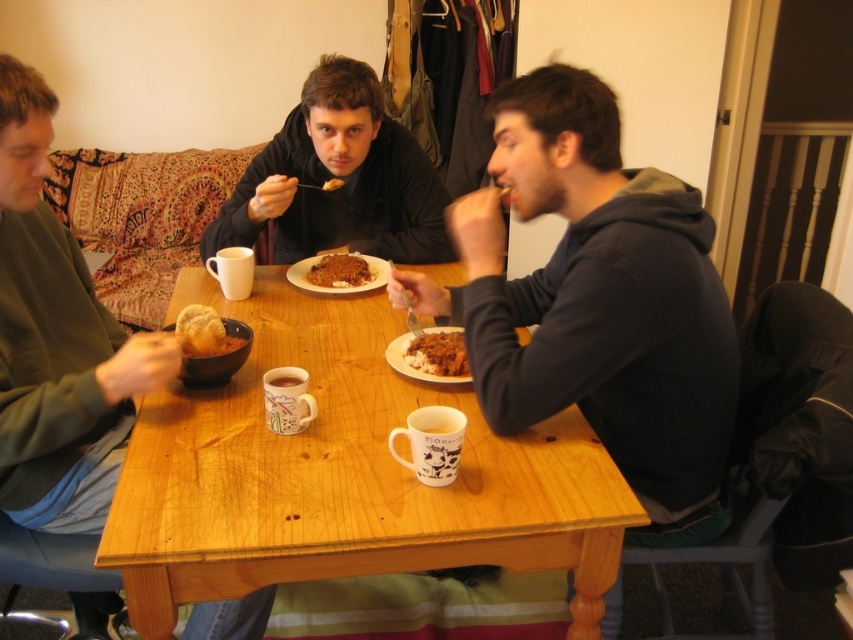
From the picture: You are a guest at this dinner table and want to place your phone between the dark gray hoodie at center and the matte brown bowl at center. Can you fit it there?

The dark gray hoodie at center is wider than the matte brown bowl at center, so there might be enough space between them to place your phone.

You are standing at the entrance of the dining area and want to find the dark gray hoodie at center. According to the coordinates provided, where should you look relative to the table?

The dark gray hoodie at center is located at coordinates point (596, 301), which means it is positioned near the center of the table. Since the coordinates are relative, you should look towards the middle area of the table to find it.

You are a guest at this dinner table. You want to reach for the golden crispy bread at center without touching the dark gray hoodie at center. Is this possible?

The dark gray hoodie at center is above the golden crispy bread at center, so you can reach for the golden crispy bread at center without touching the dark gray hoodie at center by moving under the hoodie.